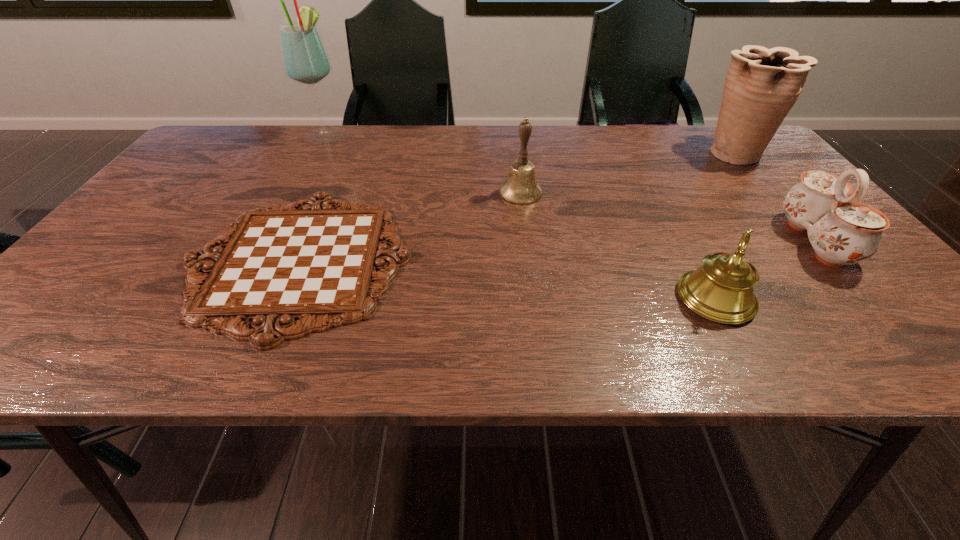
Where is `urn at the right edge`? This screenshot has width=960, height=540. urn at the right edge is located at coordinates (762, 85).

Find the location of a particular element. chinaware at the right edge is located at coordinates (842, 231).

Where is `object that is positioned at the far right corner`? The height and width of the screenshot is (540, 960). object that is positioned at the far right corner is located at coordinates coord(762,85).

You are a GUI agent. You are given a task and a screenshot of the screen. Output one action in this format:
    pyautogui.click(x=<x>, y=<y>)
    Task: Click on the free space at the far edge
    
    Given the screenshot: What is the action you would take?
    pyautogui.click(x=262, y=138)

The height and width of the screenshot is (540, 960). I want to click on vacant space at the near edge, so click(455, 324).

Find the location of a particular element. The height and width of the screenshot is (540, 960). free space at the left edge of the desktop is located at coordinates (52, 313).

At what (x,y) coordinates should I click in order to perform the action: click on vacant space at the right edge of the desktop. Please return your answer as a coordinate pair (x, y). The image size is (960, 540). Looking at the image, I should click on (750, 175).

Locate an element on the screen. Image resolution: width=960 pixels, height=540 pixels. vacant area at the far left corner of the desktop is located at coordinates (239, 158).

At what (x,y) coordinates should I click in order to perform the action: click on free spot between the farther bell and the shortest object. Please return your answer as a coordinate pair (x, y). This screenshot has height=540, width=960. Looking at the image, I should click on (410, 226).

The image size is (960, 540). I want to click on vacant area that lies between the tallest object and the nearer bell, so click(521, 217).